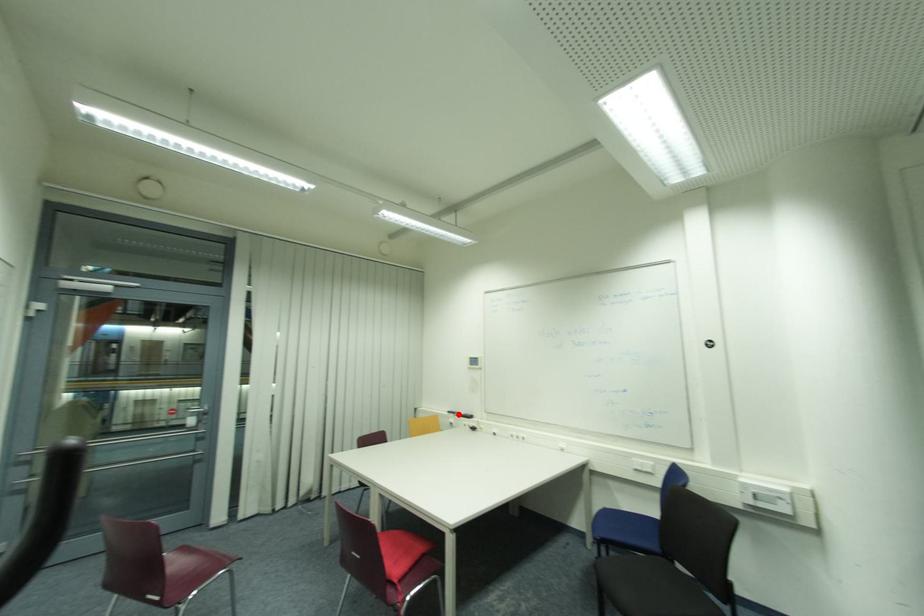
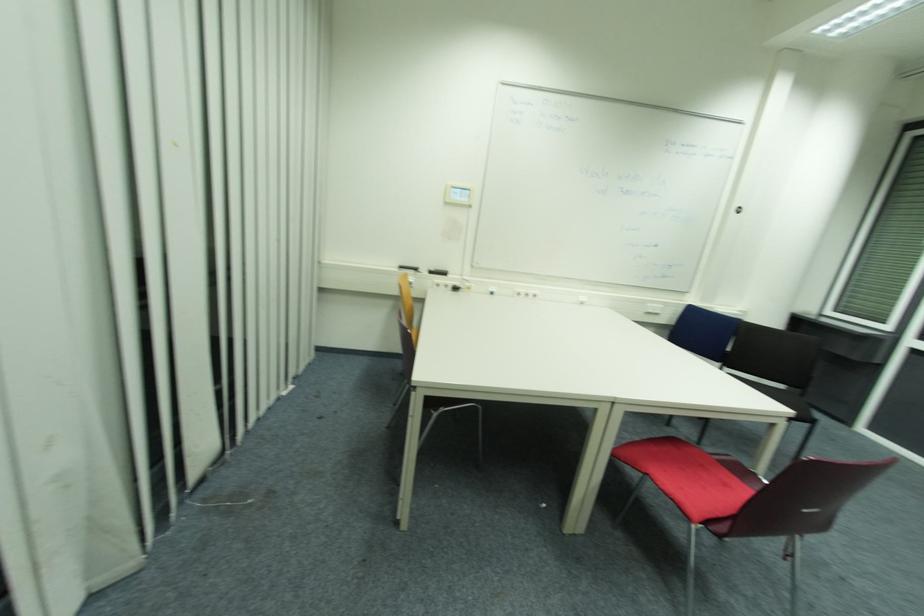
Where in the second image is the point corresponding to the highlighted location from the first image?

(419, 270)